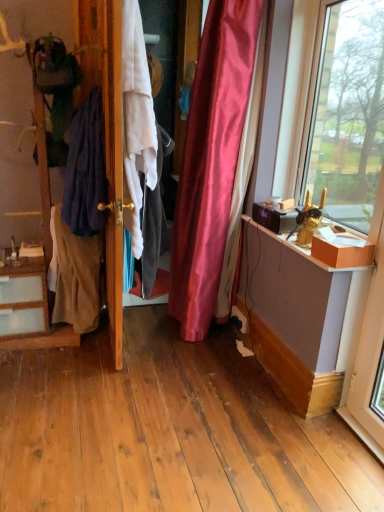
Question: Does dark blue fabric at left, positioned as the second clothing in left-to-right order, come behind dark blue fabric at left, the 3th clothing positioned from the right?

Choices:
 (A) yes
 (B) no

Answer: (B)

Question: Would you say dark blue fabric at left, the second clothing in the right-to-left sequence, is outside dark blue fabric at left, the 3th clothing positioned from the right?

Choices:
 (A) yes
 (B) no

Answer: (A)

Question: From the image's perspective, is dark blue fabric at left, positioned as the second clothing in left-to-right order, located beneath dark blue fabric at left, the 1th clothing viewed from the left?

Choices:
 (A) yes
 (B) no

Answer: (B)

Question: Does dark blue fabric at left, the second clothing in the right-to-left sequence, appear on the left side of dark blue fabric at left, the 3th clothing positioned from the right?

Choices:
 (A) yes
 (B) no

Answer: (B)

Question: From a real-world perspective, is dark blue fabric at left, the second clothing in the right-to-left sequence, beneath dark blue fabric at left, the 3th clothing positioned from the right?

Choices:
 (A) no
 (B) yes

Answer: (A)

Question: From a real-world perspective, relative to white cotton shirt at center, marked as the first clothing in a right-to-left arrangement, is wooden dresser at left vertically above or below?

Choices:
 (A) below
 (B) above

Answer: (A)

Question: Would you say wooden dresser at left is inside or outside white cotton shirt at center, which appears as the third clothing when viewed from the left?

Choices:
 (A) outside
 (B) inside

Answer: (A)

Question: Is wooden dresser at left in front of or behind white cotton shirt at center, marked as the first clothing in a right-to-left arrangement, in the image?

Choices:
 (A) front
 (B) behind

Answer: (A)

Question: In terms of height, does wooden dresser at left look taller or shorter compared to white cotton shirt at center, which appears as the third clothing when viewed from the left?

Choices:
 (A) tall
 (B) short

Answer: (A)

Question: From the image's perspective, is dark blue fabric at left, the second clothing in the right-to-left sequence, located above or below dark blue fabric at left, the 1th clothing viewed from the left?

Choices:
 (A) above
 (B) below

Answer: (A)

Question: Considering the positions of dark blue fabric at left, the second clothing in the right-to-left sequence, and dark blue fabric at left, the 1th clothing viewed from the left, in the image, is dark blue fabric at left, the second clothing in the right-to-left sequence, taller or shorter than dark blue fabric at left, the 1th clothing viewed from the left,?

Choices:
 (A) tall
 (B) short

Answer: (A)

Question: Considering their positions, is dark blue fabric at left, positioned as the second clothing in left-to-right order, located in front of or behind dark blue fabric at left, the 3th clothing positioned from the right?

Choices:
 (A) behind
 (B) front

Answer: (B)

Question: Based on their sizes in the image, would you say dark blue fabric at left, the second clothing in the right-to-left sequence, is bigger or smaller than dark blue fabric at left, the 3th clothing positioned from the right?

Choices:
 (A) big
 (B) small

Answer: (A)

Question: Do you think dark blue fabric at left, the 3th clothing positioned from the right, is within dark blue fabric at left, the second clothing in the right-to-left sequence, or outside of it?

Choices:
 (A) outside
 (B) inside

Answer: (A)

Question: From the image's perspective, is dark blue fabric at left, the 3th clothing positioned from the right, positioned above or below dark blue fabric at left, positioned as the second clothing in left-to-right order?

Choices:
 (A) above
 (B) below

Answer: (B)